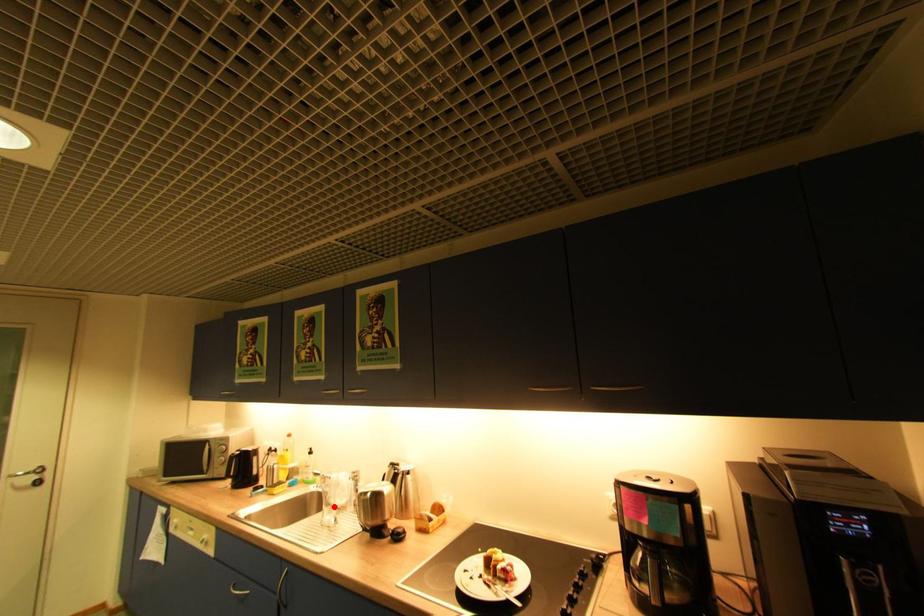
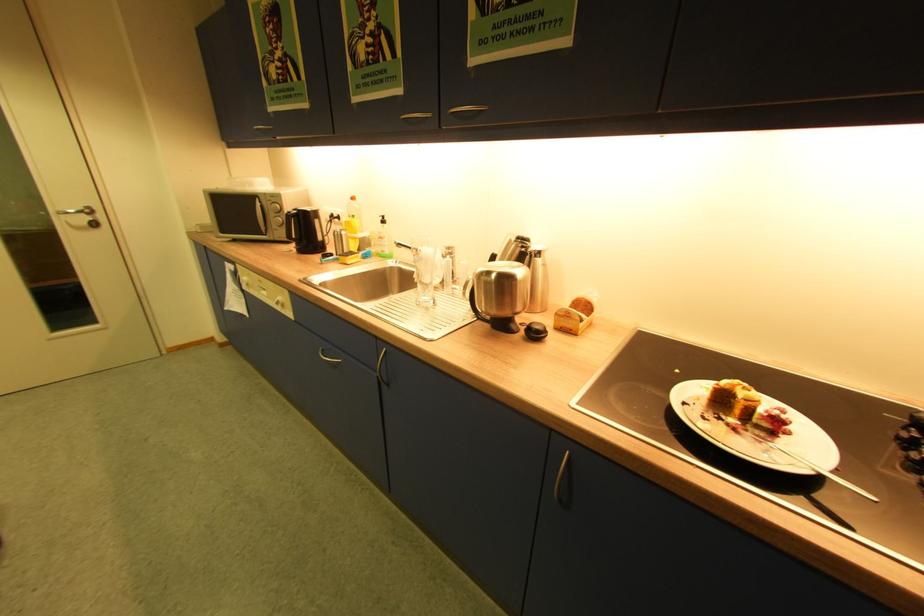
Question: I am providing you with two images of the same scene from different viewpoints. In image1, a red point is highlighted. Considering the same 3D point in image2, which of the following is correct?

Choices:
 (A) It is closer
 (B) It is farther

Answer: (A)